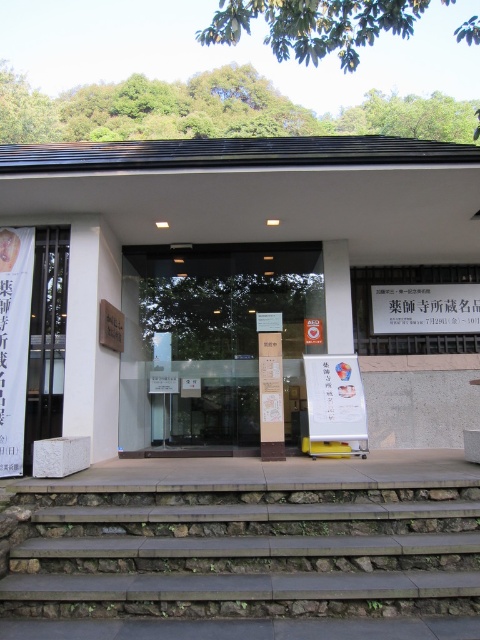
Looking at this image, you are a visitor arriving at the entrance of the building. You need to enter through the metallic gate at left but first want to check the information on the white paper sign at upper right. Which object is higher in position to read its content comfortably?

The metallic gate at left is much taller than the white paper sign at upper right, so you can comfortably read the white paper sign at upper right as it is lower and within reach.

You are standing at the entrance of a modern building and need to locate a specific point marked as point (248, 552). According to the scene description, where exactly is this point located?

The point (248, 552) is located on the brown stone stairs at lower center.